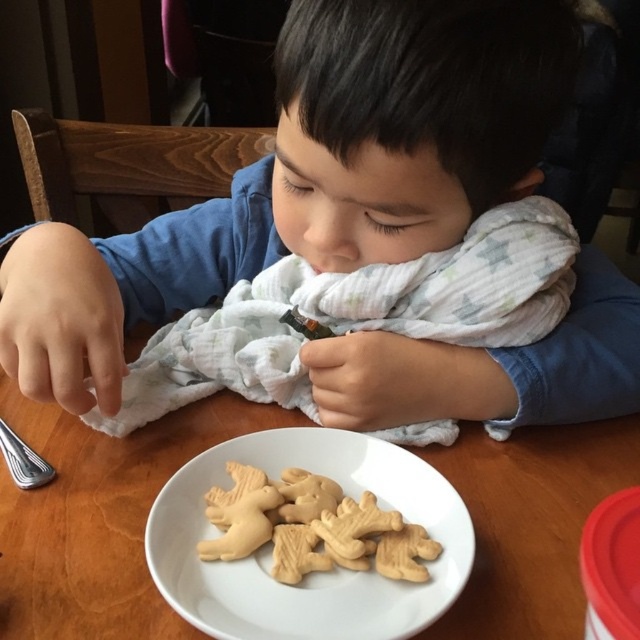
Image resolution: width=640 pixels, height=640 pixels. Find the location of `matte white scarf at lower center`. matte white scarf at lower center is located at coordinates (310, 177).

Can you confirm if wooden table at center is positioned above silver metallic fork at lower left?

No.

Is wooden table at center to the left of silver metallic fork at lower left from the viewer's perspective?

In fact, wooden table at center is to the right of silver metallic fork at lower left.

At what (x,y) coordinates should I click in order to perform the action: click on wooden table at center. Please return your answer as a coordinate pair (x, y). This screenshot has height=640, width=640. Looking at the image, I should click on (99, 516).

Is the position of white matte plate at lower center less distant than that of silver metallic fork at lower left?

Yes.

Identify the location of white matte plate at lower center. This screenshot has width=640, height=640. (310, 573).

This screenshot has width=640, height=640. I want to click on white matte plate at lower center, so click(x=310, y=573).